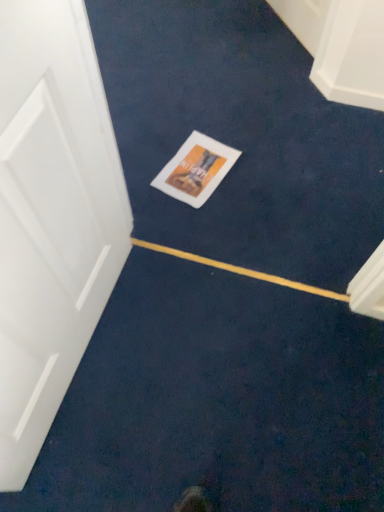
Where is `white matte postcard at center`? The image size is (384, 512). white matte postcard at center is located at coordinates (196, 169).

What do you see at coordinates (196, 169) in the screenshot?
I see `white matte postcard at center` at bounding box center [196, 169].

Find the location of a particular element. white matte postcard at center is located at coordinates (196, 169).